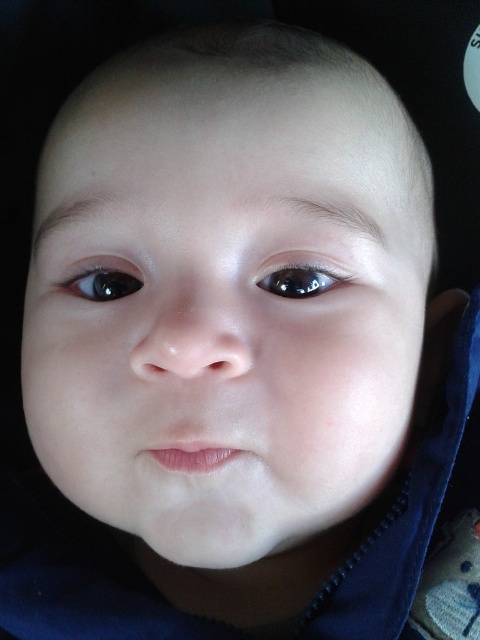
Looking at the baby in the image, which of the two eyes, the black glossy eye at upper left or the glossy black eye at upper center, is positioned more to the left side of the face?

The black glossy eye at upper left is positioned more to the left side of the face than the glossy black eye at upper center.

You are holding a 12 inch ruler and want to measure the distance between you and the point at coordinates point (95, 269) in the image. Can you reach it with your ruler?

The distance between you and the point at coordinates point (95, 269) is 16.63 inches, so the ruler cannot reach it since it is longer than the ruler.

You are a photographer adjusting the focus on a camera lens. You notice two points in the image, point 1 at coordinates point (108,291) and point 2 at coordinates point (284,278). Which point is closer to the camera lens?

Point 1 at coordinates point (108,291) is closer to the camera lens because it is further to the viewer than point 2 at coordinates point (284,278).